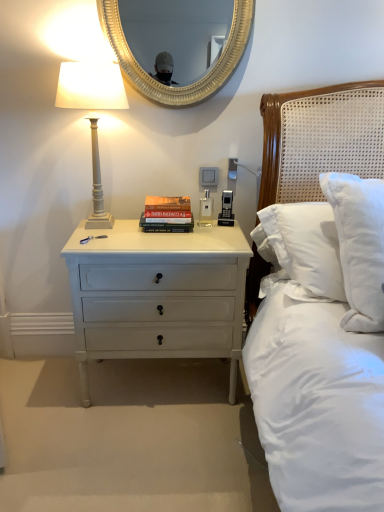
The image size is (384, 512). I want to click on vacant area that is in front of white painted wood bedside lamp at left, so click(x=108, y=242).